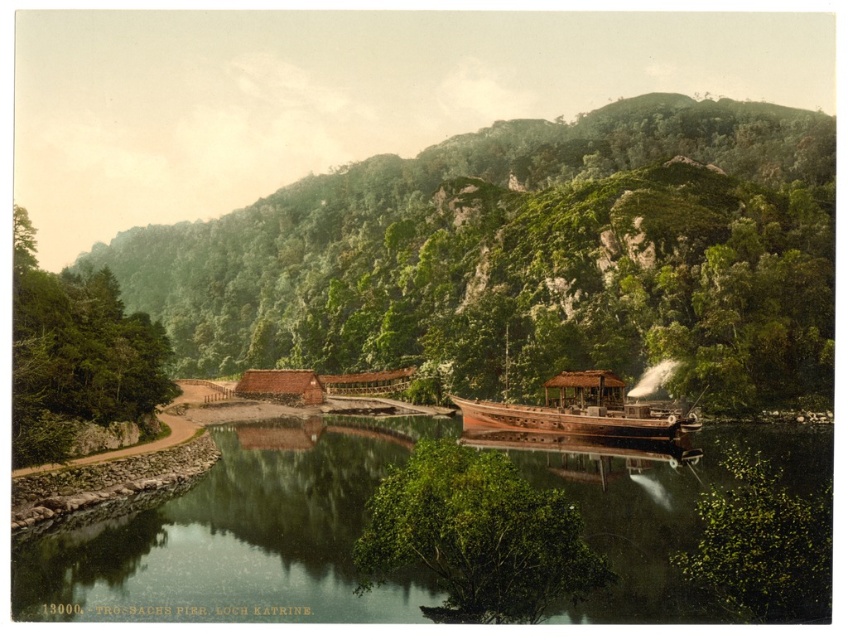
Does point (750, 556) come farther from viewer compared to point (590, 419)?

No, it is in front of (590, 419).

Does green leafy plant at lower right lie behind wooden steamboat at right?

That is False.

Is point (706, 589) less distant than point (689, 428)?

Yes, it is.

Locate an element on the screen. green leafy plant at lower right is located at coordinates (762, 544).

Does green smooth water at center have a larger size compared to green leafy plant at lower right?

Yes.

Can you confirm if green smooth water at center is smaller than green leafy plant at lower right?

No, green smooth water at center is not smaller than green leafy plant at lower right.

Based on the photo, who is more forward, (544, 464) or (823, 545)?

Positioned in front is point (823, 545).

At what (x,y) coordinates should I click in order to perform the action: click on green smooth water at center. Please return your answer as a coordinate pair (x, y). Looking at the image, I should click on 240,536.

Is green leafy bush at center thinner than green leafy trees at left?

Yes, green leafy bush at center is thinner than green leafy trees at left.

Between point (573, 564) and point (77, 401), which one is positioned in front?

Positioned in front is point (573, 564).

I want to click on green leafy bush at center, so click(x=476, y=536).